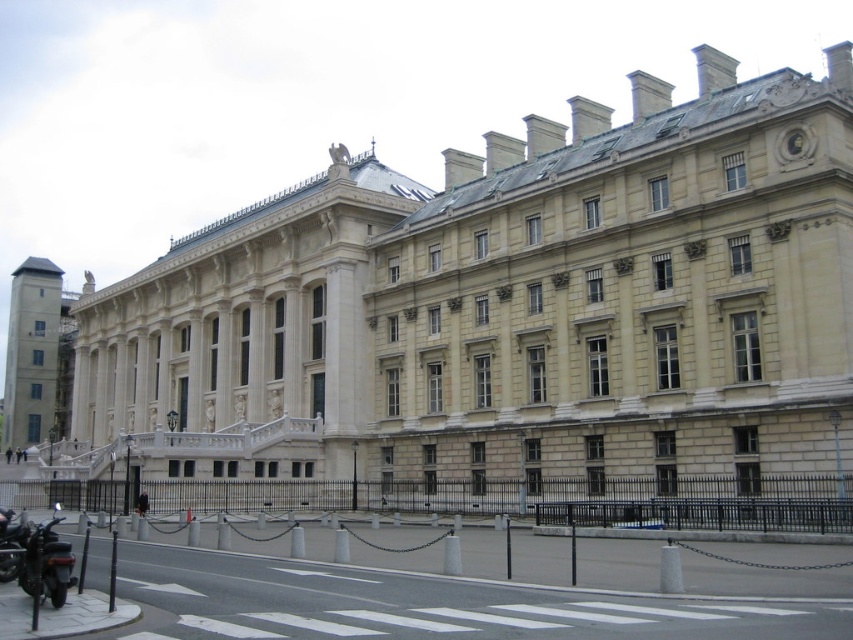
From the picture: Does beige stone palace at center lie in front of shiny black motorbike at lower left?

That is False.

Can you confirm if beige stone palace at center is thinner than shiny black motorbike at lower left?

No, beige stone palace at center is not thinner than shiny black motorbike at lower left.

Where is `beige stone palace at center`? The width and height of the screenshot is (853, 640). beige stone palace at center is located at coordinates (506, 314).

Find the location of a particular element. beige stone palace at center is located at coordinates (506, 314).